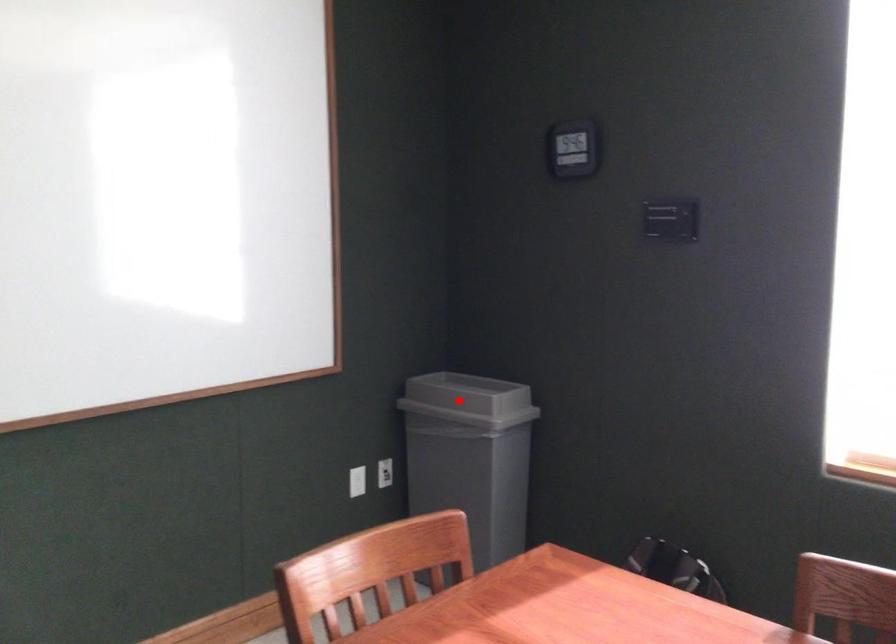
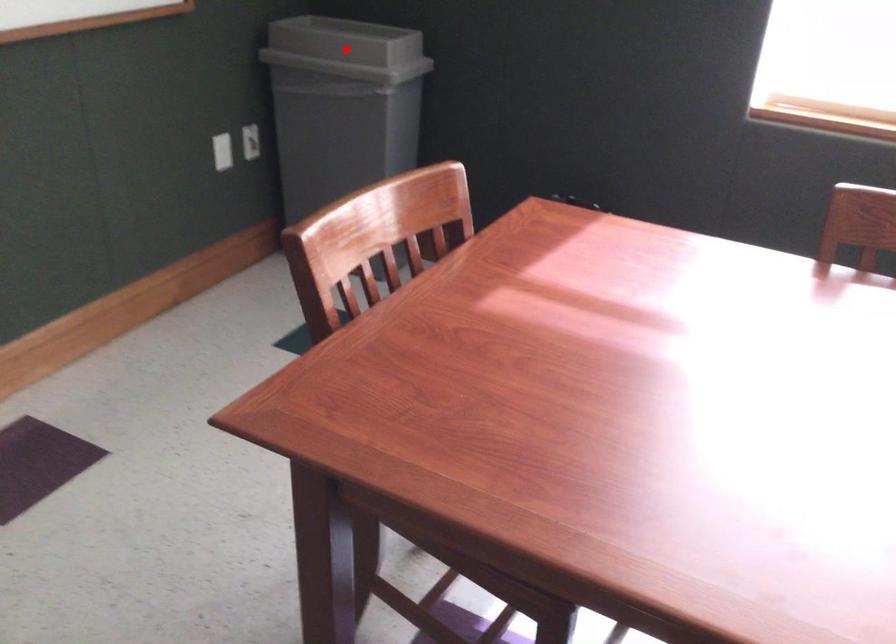
I am providing you with two images of the same scene from different viewpoints. A red point is marked on the first image and another point is marked on the second image. Are the points marked in image1 and image2 representing the same 3D position?

Yes